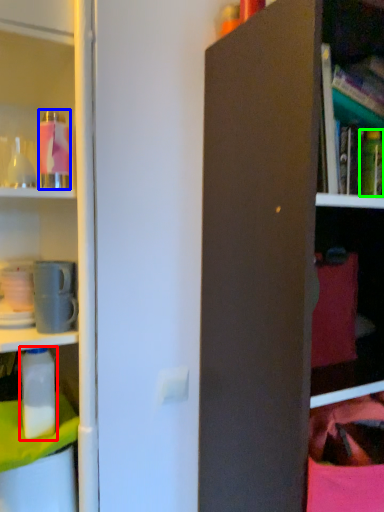
Question: Considering the real-world distances, which object is closest to bottle (highlighted by a red box)? bottle (highlighted by a blue box) or bottle (highlighted by a green box).

Choices:
 (A) bottle
 (B) bottle

Answer: (A)